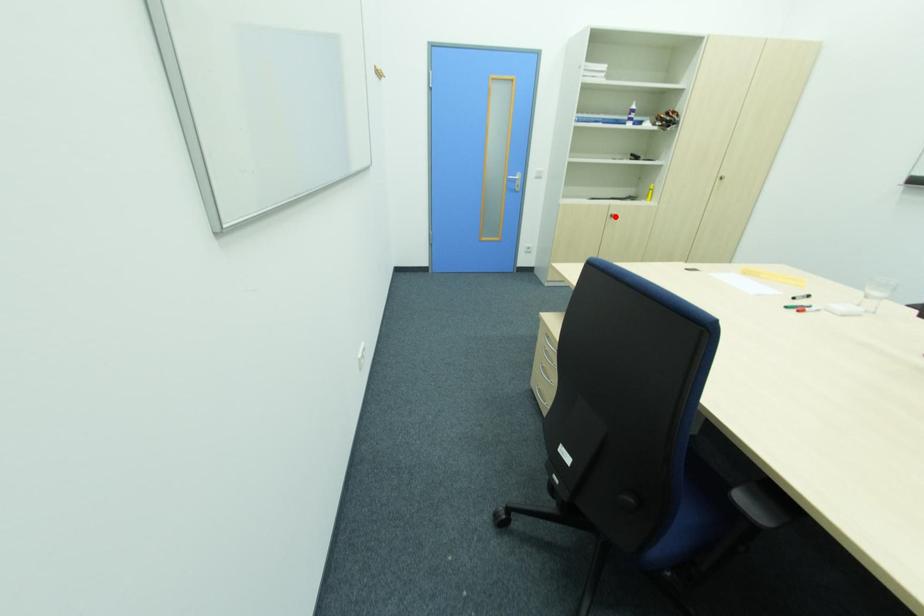
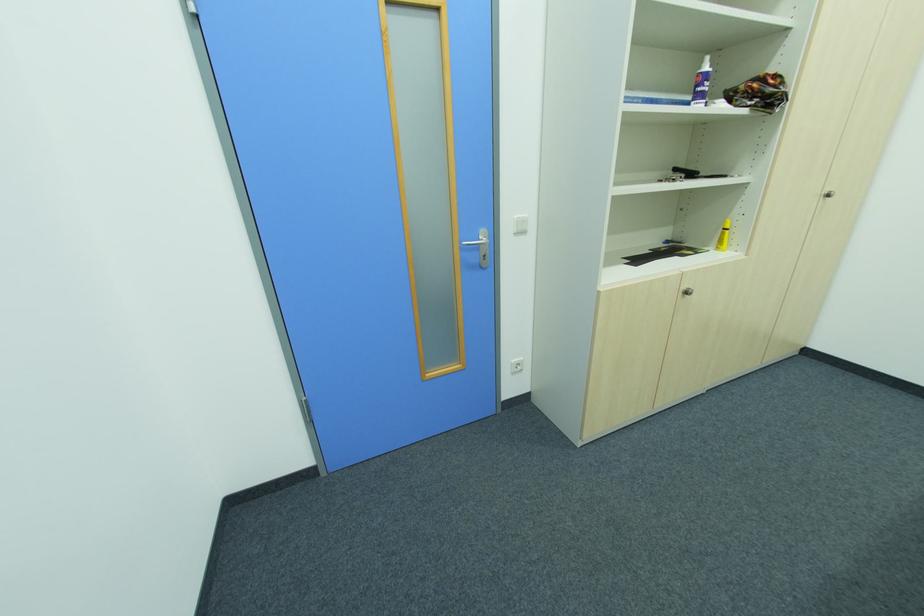
Locate, in the second image, the point that corresponds to the highlighted location in the first image.

(689, 294)